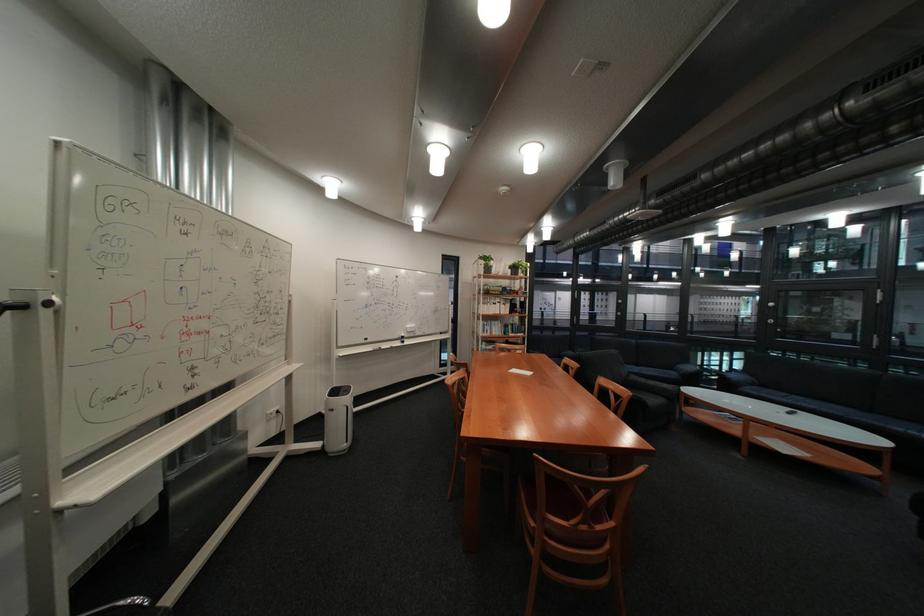
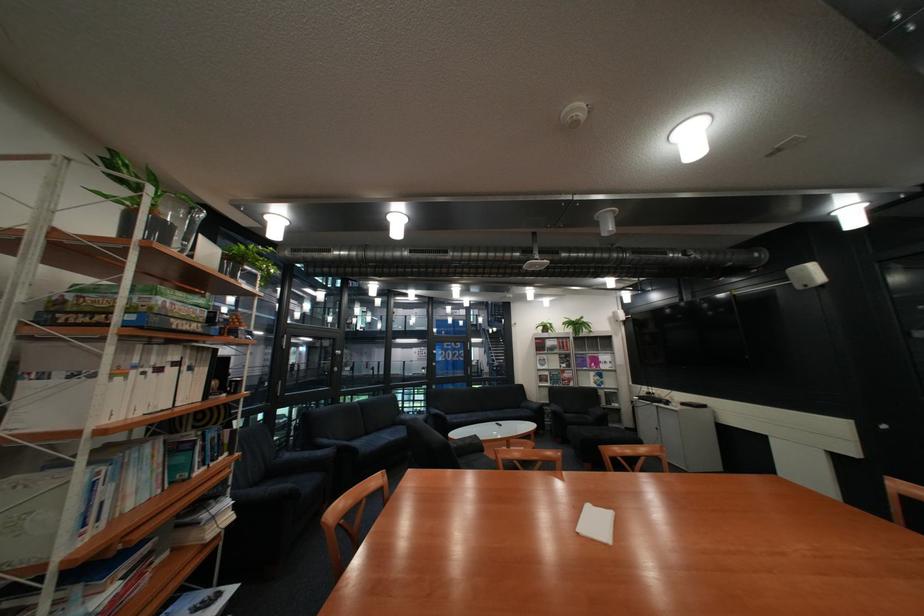
Locate, in the second image, the point that corresponds to pixel 499 291 in the first image.

(141, 312)